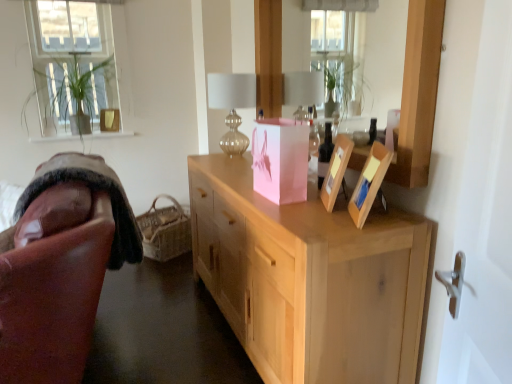
Describe the element at coordinates (60, 266) in the screenshot. I see `leather at left` at that location.

The image size is (512, 384). What do you see at coordinates (165, 230) in the screenshot?
I see `woven natural basket at lower left` at bounding box center [165, 230].

What do you see at coordinates (73, 67) in the screenshot? Image resolution: width=512 pixels, height=384 pixels. I see `clear glass window at upper left` at bounding box center [73, 67].

Locate an element on the screen. translucent glass table lamp at center is located at coordinates (232, 106).

You are a GUI agent. You are given a task and a screenshot of the screen. Output one action in this format:
    pyautogui.click(x=<x>, y=<y>)
    Task: Click on the translucent glass bottle at center
    The width and height of the screenshot is (512, 384).
    Given the screenshot: What is the action you would take?
    pyautogui.click(x=325, y=154)

Locate an element on the screen. leather at left is located at coordinates (60, 266).

How different are the orientations of clear glass window at upper left and woven natural basket at lower left in degrees?

56.3 degrees.

From the image's perspective, is clear glass window at upper left above or below woven natural basket at lower left?

clear glass window at upper left is above woven natural basket at lower left.

In the image, there is a clear glass window at upper left. At what (x,y) coordinates should I click in order to perform the action: click on basket below it (from a real-world perspective). Please return your answer as a coordinate pair (x, y). The image size is (512, 384). Looking at the image, I should click on [x=165, y=230].

Considering the sizes of clear glass window at upper left and woven natural basket at lower left in the image, is clear glass window at upper left taller or shorter than woven natural basket at lower left?

Considering their sizes, clear glass window at upper left has more height than woven natural basket at lower left.

Are natural wood cabinet at center and pink paper bag at center located far from each other?

No.

Does natural wood cabinet at center lie behind pink paper bag at center?

No.

Is natural wood cabinet at center facing away from pink paper bag at center?

No, natural wood cabinet at center's orientation is not away from pink paper bag at center.

How many degrees apart are the facing directions of natural wood cabinet at center and pink paper bag at center?

3.1 degrees.

Measure the distance from natural wood cabinet at center to translucent glass bottle at center.

21.25 inches.

This screenshot has width=512, height=384. I want to click on wine bottle located behind the natural wood cabinet at center, so click(x=325, y=154).

Based on the photo, which point is more forward, (204,263) or (319,150)?

The point (319,150) is closer.

Can you confirm if natural wood cabinet at center is taller than translucent glass bottle at center?

Indeed, natural wood cabinet at center has a greater height compared to translucent glass bottle at center.

Which object is positioned more to the right, translucent glass bottle at center or wooden mirror at upper center?

translucent glass bottle at center is more to the right.

Looking at this image, can you confirm if translucent glass bottle at center is taller than wooden mirror at upper center?

In fact, translucent glass bottle at center may be shorter than wooden mirror at upper center.

Can you confirm if translucent glass bottle at center is wider than wooden mirror at upper center?

In fact, translucent glass bottle at center might be narrower than wooden mirror at upper center.

Considering the points (327, 127) and (407, 171), which point is in front, point (327, 127) or point (407, 171)?

The point (407, 171) is in front.

Between point (178, 206) and point (82, 38), which one is positioned behind?

The point (178, 206) is more distant.

Based on the photo, considering the sizes of objects woven natural basket at lower left and clear glass window at upper left in the image provided, who is wider, woven natural basket at lower left or clear glass window at upper left?

woven natural basket at lower left.

Measure the distance between woven natural basket at lower left and clear glass window at upper left.

A distance of 1.09 meters exists between woven natural basket at lower left and clear glass window at upper left.

Is clear glass window at upper left surrounded by woven natural basket at lower left?

No, clear glass window at upper left is not a part of woven natural basket at lower left.

Measure the distance from natural wood cabinet at center to wooden mirror at upper center.

natural wood cabinet at center and wooden mirror at upper center are 4.20 feet apart.

Considering the sizes of objects natural wood cabinet at center and wooden mirror at upper center in the image provided, who is taller, natural wood cabinet at center or wooden mirror at upper center?

With more height is natural wood cabinet at center.

Considering the relative sizes of natural wood cabinet at center and wooden mirror at upper center in the image provided, is natural wood cabinet at center bigger than wooden mirror at upper center?

Indeed, natural wood cabinet at center has a larger size compared to wooden mirror at upper center.

Considering the positions of objects translucent glass bottle at center and translucent glass table lamp at center in the image provided, who is in front, translucent glass bottle at center or translucent glass table lamp at center?

translucent glass bottle at center is more forward.

Is translucent glass bottle at center not within translucent glass table lamp at center?

That's correct, translucent glass bottle at center is outside of translucent glass table lamp at center.

From the image's perspective, who appears lower, translucent glass bottle at center or translucent glass table lamp at center?

translucent glass bottle at center.

Is the surface of translucent glass bottle at center in direct contact with translucent glass table lamp at center?

They are not placed beside each other.

Find the location of `basket located on the right of clear glass window at upper left`. basket located on the right of clear glass window at upper left is located at coordinates (165, 230).

Find the location of a particular element. picture frame located above the natural wood cabinet at center (from the image's perspective) is located at coordinates (280, 159).

Based on their spatial positions, is natural wood cabinet at center or translucent glass table lamp at center closer to wooden mirror at upper center?

The object closer to wooden mirror at upper center is translucent glass table lamp at center.

When comparing their distances from pink paper bag at center, does translucent glass table lamp at center or leather at left seem closer?

→ translucent glass table lamp at center is positioned closer to the anchor pink paper bag at center.

Looking at the image, which one is located further to translucent glass bottle at center, natural wood cabinet at center or clear glass window at upper left?

clear glass window at upper left is further to translucent glass bottle at center.

When comparing their distances from woven natural basket at lower left, does wooden mirror at upper center or pink paper bag at center seem further?

pink paper bag at center.

Looking at the image, which one is located further to wooden mirror at upper center, translucent glass bottle at center or translucent glass table lamp at center?

Among the two, translucent glass bottle at center is located further to wooden mirror at upper center.

Looking at the image, which one is located closer to woven natural basket at lower left, translucent glass bottle at center or translucent glass table lamp at center?

Based on the image, translucent glass table lamp at center appears to be nearer to woven natural basket at lower left.

Based on their spatial positions, is translucent glass bottle at center or woven natural basket at lower left further from translucent glass table lamp at center?

Among the two, woven natural basket at lower left is located further to translucent glass table lamp at center.

Considering their positions, is pink paper bag at center positioned closer to woven natural basket at lower left than natural wood cabinet at center?

The object closer to woven natural basket at lower left is natural wood cabinet at center.

Locate an element on the screen. The height and width of the screenshot is (384, 512). chair located between pink paper bag at center and clear glass window at upper left in the depth direction is located at coordinates (60, 266).

Where is `table lamp between wooden mirror at upper center and clear glass window at upper left in the front-back direction`? table lamp between wooden mirror at upper center and clear glass window at upper left in the front-back direction is located at coordinates (232, 106).

The height and width of the screenshot is (384, 512). Identify the location of basket between wooden mirror at upper center and clear glass window at upper left along the z-axis. (165, 230).

You are a GUI agent. You are given a task and a screenshot of the screen. Output one action in this format:
    pyautogui.click(x=<x>, y=<y>)
    Task: Click on the wine bottle located between pink paper bag at center and translucent glass table lamp at center in the depth direction
    
    Given the screenshot: What is the action you would take?
    pyautogui.click(x=325, y=154)